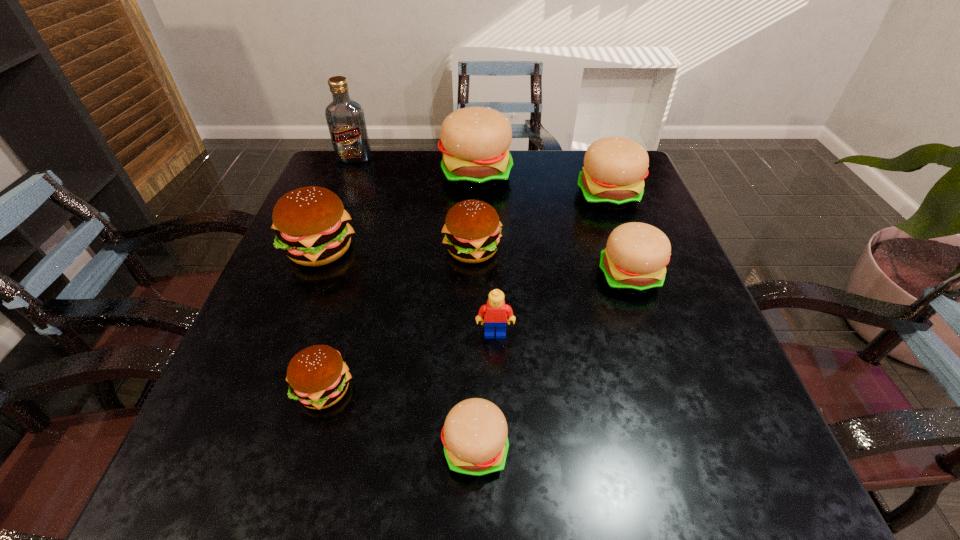
You are a GUI agent. You are given a task and a screenshot of the screen. Output one action in this format:
    pyautogui.click(x=<x>, y=<y>)
    Task: Click on the vodka
    
    Given the screenshot: What is the action you would take?
    point(345,118)

The image size is (960, 540). I want to click on the biggest beige hamburger, so click(475, 141).

The height and width of the screenshot is (540, 960). In order to click on the biggest brown hamburger in this screenshot , I will do `click(310, 223)`.

What are the coordinates of `the second biggest beige hamburger` in the screenshot? It's located at (614, 170).

At what (x,y) coordinates should I click in order to perform the action: click on the rightmost brown hamburger. Please return your answer as a coordinate pair (x, y). Image resolution: width=960 pixels, height=540 pixels. Looking at the image, I should click on (472, 229).

I want to click on the second nearest beige hamburger, so click(634, 261).

I want to click on the third nearest object, so click(495, 312).

You are a GUI agent. You are given a task and a screenshot of the screen. Output one action in this format:
    pyautogui.click(x=<x>, y=<y>)
    Task: Click on the nearest brown hamburger
    This screenshot has width=960, height=540.
    Given the screenshot: What is the action you would take?
    pyautogui.click(x=318, y=377)

This screenshot has height=540, width=960. I want to click on the second nearest object, so click(318, 377).

Where is `the smallest beige hamburger`? This screenshot has height=540, width=960. the smallest beige hamburger is located at coordinates (474, 435).